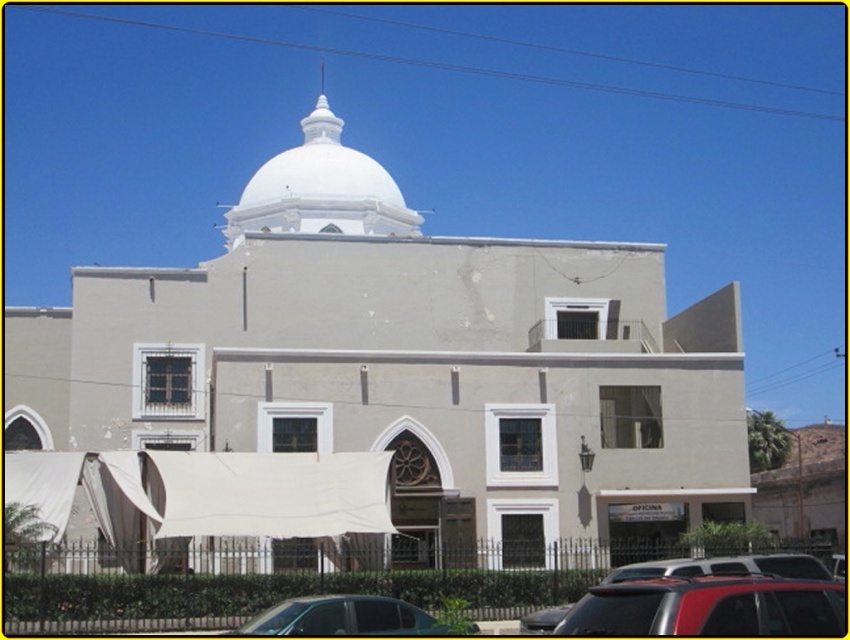
Consider the image. Measure the distance between white concrete church at center and red matte suv at lower right.

92.12 feet

Who is lower down, white concrete church at center or red matte suv at lower right?

red matte suv at lower right is lower down.

Does point (166, 422) come in front of point (723, 595)?

That is False.

Find the location of a particular element. The image size is (850, 640). white concrete church at center is located at coordinates (404, 364).

Who is positioned more to the left, white smooth dome at upper center or metallic silver car at lower center?

white smooth dome at upper center

Is white smooth dome at upper center behind metallic silver car at lower center?

Yes, white smooth dome at upper center is behind metallic silver car at lower center.

Is point (367, 164) closer to camera compared to point (323, 634)?

No, (367, 164) is behind (323, 634).

In order to click on white smooth dome at upper center in this screenshot , I will do `click(320, 188)`.

Is white concrete church at center further to camera compared to metallic silver car at lower center?

Yes, white concrete church at center is behind metallic silver car at lower center.

Locate an element on the screen. white concrete church at center is located at coordinates (404, 364).

Which is behind, point (63, 314) or point (408, 621)?

Positioned behind is point (63, 314).

Identify the location of white concrete church at center. The image size is (850, 640). (404, 364).